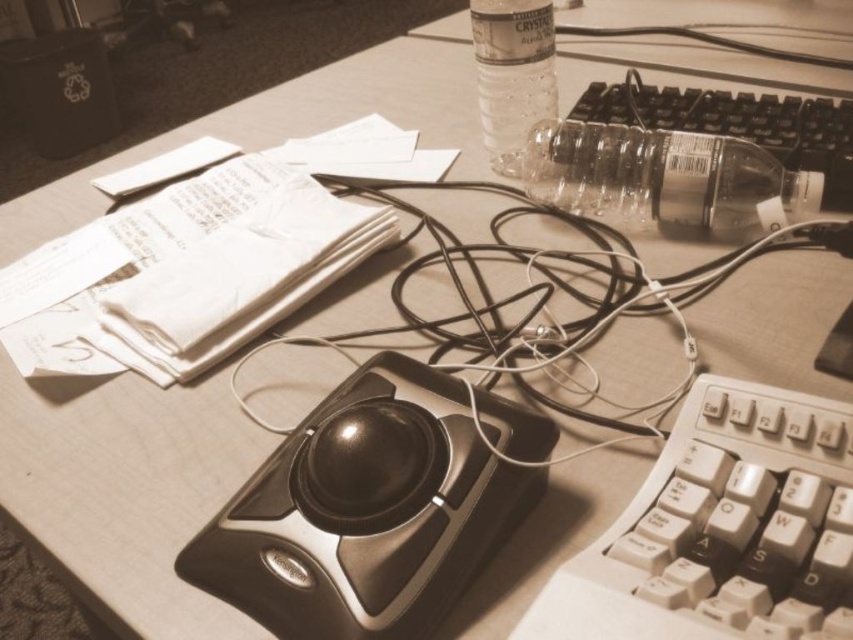
You are organizing the desk and need to move the clear plastic bottle at upper center. To do so, do you need to first move the black cable at center which is blocking it?

The black cable at center is in front of the clear plastic bottle at upper center, so yes, you need to move the black cable at center first to access the clear plastic bottle at upper center.

You are organizing the desk and want to place the black cable at center and the clear plastic bottle at upper center in a drawer. Which item should you place first if the drawer has limited width?

The black cable at center might be wider than clear plastic bottle at upper center, so you should place the clear plastic bottle at upper center first to ensure both items fit in the drawer.